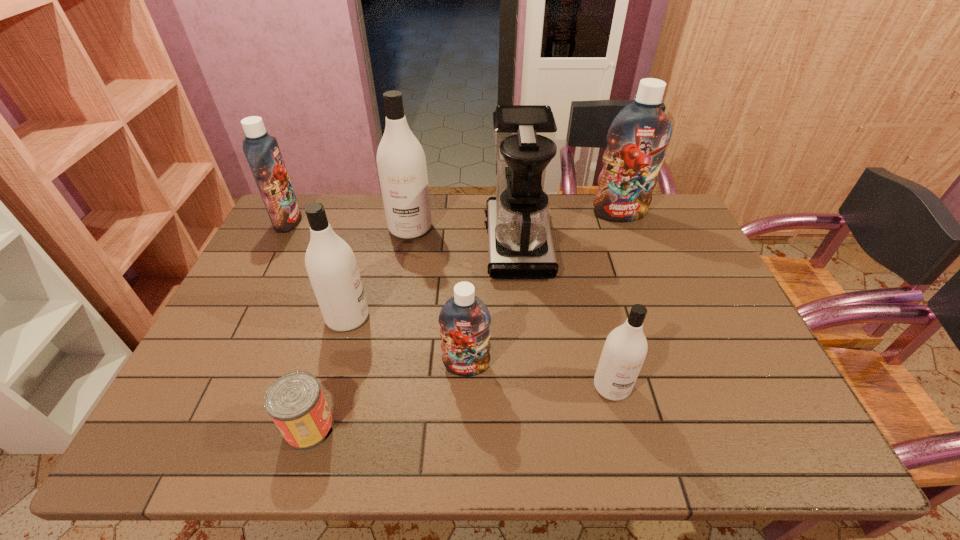
At what (x,y) coordinates should I click in order to perform the action: click on vacant point located 0.320m on the front-facing side of the fourth farthest shampoo. Please return your answer as a coordinate pair (x, y). Looking at the image, I should click on (488, 318).

In order to click on blank area located 0.090m on the front label of the third shampoo from right to left in this screenshot , I will do `click(466, 411)`.

Locate an element on the screen. The height and width of the screenshot is (540, 960). vacant area situated 0.060m on the front-facing side of the seventh object from left to right is located at coordinates tap(622, 428).

Locate an element on the screen. This screenshot has height=540, width=960. vacant space located on the left of the nearest object is located at coordinates (167, 427).

I want to click on coffee maker at the far edge, so click(520, 246).

Locate an element on the screen. Image resolution: width=960 pixels, height=540 pixels. object that is at the near edge is located at coordinates (295, 402).

Locate an element on the screen. This screenshot has height=540, width=960. object that is at the left edge is located at coordinates (262, 152).

The width and height of the screenshot is (960, 540). In order to click on object at the right edge in this screenshot , I will do `click(638, 136)`.

At what (x,y) coordinates should I click in order to perform the action: click on object that is at the far left corner. Please return your answer as a coordinate pair (x, y). Looking at the image, I should click on (262, 152).

At what (x,y) coordinates should I click in order to perform the action: click on object at the far right corner. Please return your answer as a coordinate pair (x, y). The image size is (960, 540). Looking at the image, I should click on (638, 136).